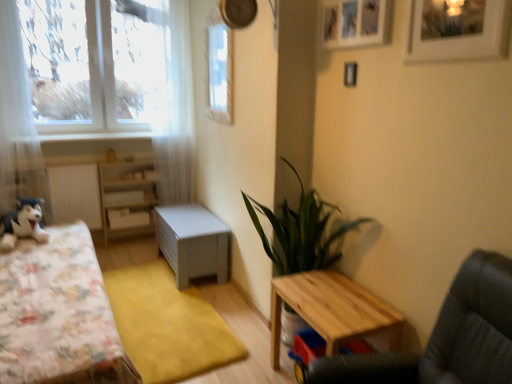
Question: Can you confirm if matte gray chest at center, the second table positioned from the right, is wider than yellow carpet at center?

Choices:
 (A) no
 (B) yes

Answer: (A)

Question: From the image's perspective, is matte gray chest at center, the second table positioned from the front, located above yellow carpet at center?

Choices:
 (A) no
 (B) yes

Answer: (B)

Question: Is matte gray chest at center, the second table positioned from the front, positioned far away from yellow carpet at center?

Choices:
 (A) no
 (B) yes

Answer: (A)

Question: Does matte gray chest at center, the second table positioned from the front, have a smaller size compared to yellow carpet at center?

Choices:
 (A) yes
 (B) no

Answer: (A)

Question: Is matte gray chest at center, which is the first table from left to right, bigger than yellow carpet at center?

Choices:
 (A) yes
 (B) no

Answer: (B)

Question: Can we say matte gray chest at center, the first table from the back, lies outside yellow carpet at center?

Choices:
 (A) yes
 (B) no

Answer: (A)

Question: Is white matte drawer at center oriented towards wooden table at lower right, the second table positioned from the left?

Choices:
 (A) no
 (B) yes

Answer: (B)

Question: Can you confirm if white matte drawer at center is wider than wooden table at lower right, the second table positioned from the left?

Choices:
 (A) no
 (B) yes

Answer: (A)

Question: Is white matte drawer at center positioned in front of wooden table at lower right, the first table viewed from the right?

Choices:
 (A) no
 (B) yes

Answer: (A)

Question: Is white matte drawer at center facing away from wooden table at lower right, the first table viewed from the right?

Choices:
 (A) yes
 (B) no

Answer: (B)

Question: From a real-world perspective, is white matte drawer at center on top of wooden table at lower right, the first table viewed from the right?

Choices:
 (A) no
 (B) yes

Answer: (B)

Question: From the image's perspective, is white matte drawer at center on wooden table at lower right, which is the second table in back-to-front order?

Choices:
 (A) no
 (B) yes

Answer: (B)

Question: Are fluffy fabric bed at left and wooden swivel chair at lower right far apart?

Choices:
 (A) no
 (B) yes

Answer: (B)